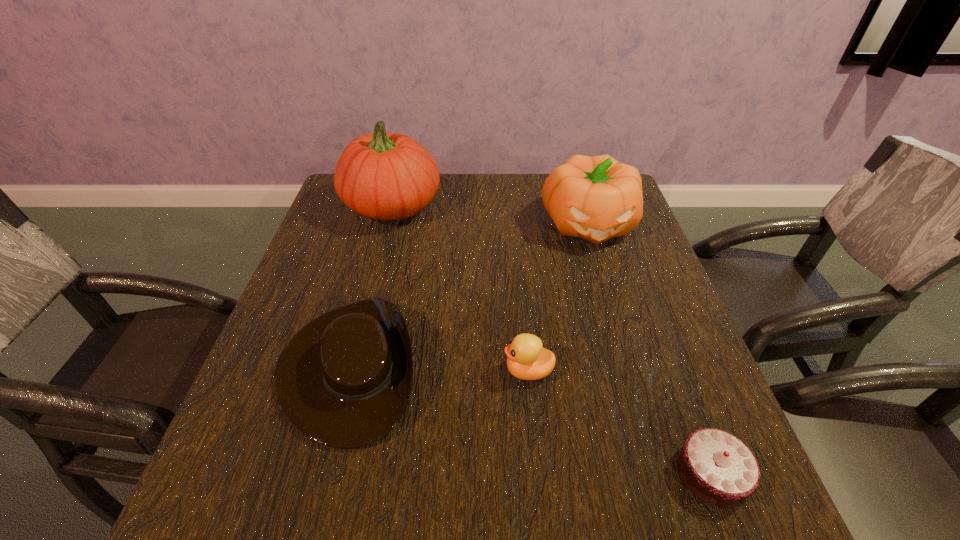
In order to click on the tallest object in this screenshot , I will do `click(384, 176)`.

At what (x,y) coordinates should I click in order to perform the action: click on the taller pumpkin. Please return your answer as a coordinate pair (x, y). The width and height of the screenshot is (960, 540). Looking at the image, I should click on (384, 176).

Find the location of a particular element. The height and width of the screenshot is (540, 960). the right pumpkin is located at coordinates (596, 198).

Find the location of a particular element. the shorter pumpkin is located at coordinates (596, 198).

The width and height of the screenshot is (960, 540). What are the coordinates of `the third object from right to left` in the screenshot? It's located at (526, 358).

The image size is (960, 540). Find the location of `duckling`. duckling is located at coordinates (526, 358).

Where is `cowboy hat`? The height and width of the screenshot is (540, 960). cowboy hat is located at coordinates (344, 380).

This screenshot has height=540, width=960. Identify the location of chocolate cake. (716, 466).

Locate an element on the screen. The height and width of the screenshot is (540, 960). vacant region located on the front of the left pumpkin is located at coordinates (367, 304).

Identify the location of free space located 0.250m on the carved face of the fourth shortest object. (621, 330).